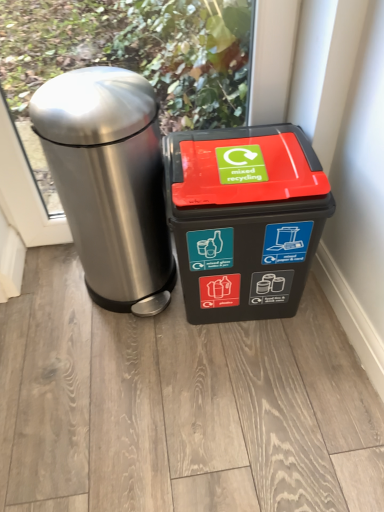
How much space does black plastic recycling bin at center, which is the 1th waste container from right to left, occupy horizontally?

35.67 centimeters.

Locate an element on the screen. black plastic recycling bin at center, which is the 2th waste container from left to right is located at coordinates (244, 219).

Describe the element at coordinates (244, 219) in the screenshot. I see `black plastic recycling bin at center, which is the 2th waste container from left to right` at that location.

Measure the distance between polished stainless steel trash can at left, arranged as the 1th waste container when viewed from the left, and camera.

polished stainless steel trash can at left, arranged as the 1th waste container when viewed from the left, and camera are 35.31 inches apart.

In order to face polished stainless steel trash can at left, arranged as the 1th waste container when viewed from the left, should I rotate leftwards or rightwards?

You should rotate left by 10.367 degrees.

You are a GUI agent. You are given a task and a screenshot of the screen. Output one action in this format:
    pyautogui.click(x=<x>, y=<y>)
    Task: Click on the polished stainless steel trash can at left, arranged as the second waste container when viewed from the right
    This screenshot has height=512, width=384.
    Given the screenshot: What is the action you would take?
    pyautogui.click(x=110, y=182)

What do you see at coordinates (110, 182) in the screenshot? I see `polished stainless steel trash can at left, arranged as the 1th waste container when viewed from the left` at bounding box center [110, 182].

Identify the location of black plastic recycling bin at center, which is the 2th waste container from left to right. (244, 219).

Which is more to the right, black plastic recycling bin at center, which is the 2th waste container from left to right, or polished stainless steel trash can at left, arranged as the 1th waste container when viewed from the left?

Positioned to the right is black plastic recycling bin at center, which is the 2th waste container from left to right.

Which object is more forward, black plastic recycling bin at center, which is the 2th waste container from left to right, or polished stainless steel trash can at left, arranged as the 1th waste container when viewed from the left?

polished stainless steel trash can at left, arranged as the 1th waste container when viewed from the left, is closer to the camera.

Between point (187, 273) and point (99, 215), which one is positioned behind?

The point (187, 273) is more distant.

From the image's perspective, is black plastic recycling bin at center, which is the 2th waste container from left to right, below polished stainless steel trash can at left, arranged as the second waste container when viewed from the right?

Indeed, from the image's perspective, black plastic recycling bin at center, which is the 2th waste container from left to right, is shown beneath polished stainless steel trash can at left, arranged as the second waste container when viewed from the right.

From a real-world perspective, is black plastic recycling bin at center, which is the 1th waste container from right to left, physically located above or below polished stainless steel trash can at left, arranged as the 1th waste container when viewed from the left?

black plastic recycling bin at center, which is the 1th waste container from right to left, is below polished stainless steel trash can at left, arranged as the 1th waste container when viewed from the left.

Considering the sizes of black plastic recycling bin at center, which is the 2th waste container from left to right, and polished stainless steel trash can at left, arranged as the second waste container when viewed from the right, in the image, is black plastic recycling bin at center, which is the 2th waste container from left to right, wider or thinner than polished stainless steel trash can at left, arranged as the second waste container when viewed from the right,?

In the image, black plastic recycling bin at center, which is the 2th waste container from left to right, appears to be more narrow than polished stainless steel trash can at left, arranged as the second waste container when viewed from the right.

Considering the sizes of objects black plastic recycling bin at center, which is the 2th waste container from left to right, and polished stainless steel trash can at left, arranged as the second waste container when viewed from the right, in the image provided, who is taller, black plastic recycling bin at center, which is the 2th waste container from left to right, or polished stainless steel trash can at left, arranged as the second waste container when viewed from the right,?

polished stainless steel trash can at left, arranged as the second waste container when viewed from the right.

Based on their sizes in the image, would you say black plastic recycling bin at center, which is the 2th waste container from left to right, is bigger or smaller than polished stainless steel trash can at left, arranged as the 1th waste container when viewed from the left?

In the image, black plastic recycling bin at center, which is the 2th waste container from left to right, appears to be smaller than polished stainless steel trash can at left, arranged as the 1th waste container when viewed from the left.

Consider the image. Would you say black plastic recycling bin at center, which is the 1th waste container from right to left, is outside polished stainless steel trash can at left, arranged as the second waste container when viewed from the right?

Indeed, black plastic recycling bin at center, which is the 1th waste container from right to left, is completely outside polished stainless steel trash can at left, arranged as the second waste container when viewed from the right.

Is black plastic recycling bin at center, which is the 1th waste container from right to left, not close to polished stainless steel trash can at left, arranged as the second waste container when viewed from the right?

No.

Is black plastic recycling bin at center, which is the 2th waste container from left to right, facing towards polished stainless steel trash can at left, arranged as the second waste container when viewed from the right?

No, black plastic recycling bin at center, which is the 2th waste container from left to right, is not turned towards polished stainless steel trash can at left, arranged as the second waste container when viewed from the right.

You are a GUI agent. You are given a task and a screenshot of the screen. Output one action in this format:
    pyautogui.click(x=<x>, y=<y>)
    Task: Click on the waste container below the polished stainless steel trash can at left, arranged as the second waste container when viewed from the right (from a real-world perspective)
    This screenshot has height=512, width=384.
    Given the screenshot: What is the action you would take?
    pyautogui.click(x=244, y=219)

Based on their positions, is polished stainless steel trash can at left, arranged as the second waste container when viewed from the right, located to the left or right of black plastic recycling bin at center, which is the 2th waste container from left to right?

Based on their positions, polished stainless steel trash can at left, arranged as the second waste container when viewed from the right, is located to the left of black plastic recycling bin at center, which is the 2th waste container from left to right.

From the picture: Between polished stainless steel trash can at left, arranged as the 1th waste container when viewed from the left, and black plastic recycling bin at center, which is the 1th waste container from right to left, which one is positioned behind?

black plastic recycling bin at center, which is the 1th waste container from right to left, is more distant.

Does point (155, 298) come farther from viewer compared to point (257, 282)?

That is True.

From the image's perspective, would you say polished stainless steel trash can at left, arranged as the 1th waste container when viewed from the left, is shown under black plastic recycling bin at center, which is the 2th waste container from left to right?

Incorrect, from the image's perspective, polished stainless steel trash can at left, arranged as the 1th waste container when viewed from the left, is higher than black plastic recycling bin at center, which is the 2th waste container from left to right.

Looking at this image, from a real-world perspective, relative to black plastic recycling bin at center, which is the 1th waste container from right to left, is polished stainless steel trash can at left, arranged as the 1th waste container when viewed from the left, vertically above or below?

polished stainless steel trash can at left, arranged as the 1th waste container when viewed from the left, is situated higher than black plastic recycling bin at center, which is the 1th waste container from right to left, in the real world.

Looking at their sizes, would you say polished stainless steel trash can at left, arranged as the second waste container when viewed from the right, is wider or thinner than black plastic recycling bin at center, which is the 2th waste container from left to right?

Clearly, polished stainless steel trash can at left, arranged as the second waste container when viewed from the right, has more width compared to black plastic recycling bin at center, which is the 2th waste container from left to right.

Considering the sizes of objects polished stainless steel trash can at left, arranged as the 1th waste container when viewed from the left, and black plastic recycling bin at center, which is the 2th waste container from left to right, in the image provided, who is shorter, polished stainless steel trash can at left, arranged as the 1th waste container when viewed from the left, or black plastic recycling bin at center, which is the 2th waste container from left to right,?

With less height is black plastic recycling bin at center, which is the 2th waste container from left to right.

Looking at this image, considering the sizes of objects polished stainless steel trash can at left, arranged as the second waste container when viewed from the right, and black plastic recycling bin at center, which is the 1th waste container from right to left, in the image provided, who is bigger, polished stainless steel trash can at left, arranged as the second waste container when viewed from the right, or black plastic recycling bin at center, which is the 1th waste container from right to left,?

polished stainless steel trash can at left, arranged as the second waste container when viewed from the right.

Would you say polished stainless steel trash can at left, arranged as the second waste container when viewed from the right, is outside black plastic recycling bin at center, which is the 1th waste container from right to left?

Yes, polished stainless steel trash can at left, arranged as the second waste container when viewed from the right, is outside of black plastic recycling bin at center, which is the 1th waste container from right to left.

Are polished stainless steel trash can at left, arranged as the 1th waste container when viewed from the left, and black plastic recycling bin at center, which is the 2th waste container from left to right, located far from each other?

polished stainless steel trash can at left, arranged as the 1th waste container when viewed from the left, is actually quite close to black plastic recycling bin at center, which is the 2th waste container from left to right.

Is black plastic recycling bin at center, which is the 2th waste container from left to right, at the back of polished stainless steel trash can at left, arranged as the 1th waste container when viewed from the left?

polished stainless steel trash can at left, arranged as the 1th waste container when viewed from the left, is not turned away from black plastic recycling bin at center, which is the 2th waste container from left to right.

How many degrees apart are the facing directions of polished stainless steel trash can at left, arranged as the second waste container when viewed from the right, and black plastic recycling bin at center, which is the 1th waste container from right to left?

The angle between the facing direction of polished stainless steel trash can at left, arranged as the second waste container when viewed from the right, and the facing direction of black plastic recycling bin at center, which is the 1th waste container from right to left, is 5.18 degrees.

At what (x,y) coordinates should I click in order to perform the action: click on waste container in front of the black plastic recycling bin at center, which is the 2th waste container from left to right. Please return your answer as a coordinate pair (x, y). This screenshot has width=384, height=512. Looking at the image, I should click on (110, 182).

The height and width of the screenshot is (512, 384). Find the location of `waste container in front of the black plastic recycling bin at center, which is the 1th waste container from right to left`. waste container in front of the black plastic recycling bin at center, which is the 1th waste container from right to left is located at coordinates (110, 182).

Identify the location of waste container above the black plastic recycling bin at center, which is the 2th waste container from left to right (from a real-world perspective). The image size is (384, 512). (110, 182).